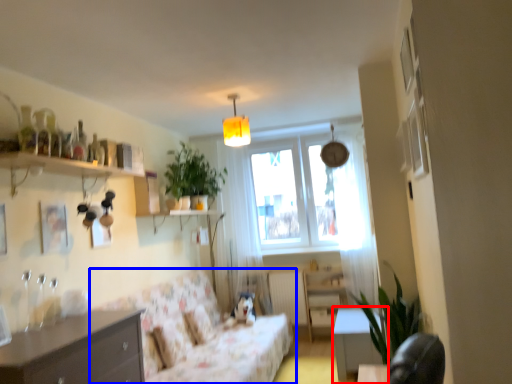
Question: Which point is further to the camera, table (highlighted by a red box) or studio couch (highlighted by a blue box)?

Choices:
 (A) table
 (B) studio couch

Answer: (A)